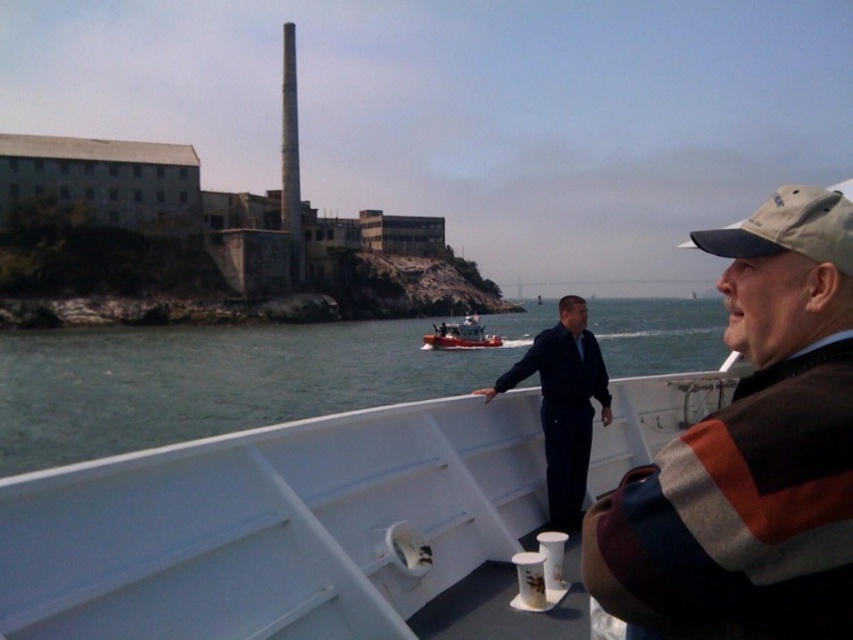
Question: Does brown striped sweater at right have a larger size compared to green water at center?

Choices:
 (A) no
 (B) yes

Answer: (A)

Question: Which object appears closest to the camera in this image?

Choices:
 (A) metallic red boat at center
 (B) green water at center
 (C) dark blue suit at center
 (D) brown striped sweater at right

Answer: (D)

Question: Does green water at center appear under metallic red boat at center?

Choices:
 (A) no
 (B) yes

Answer: (A)

Question: Estimate the real-world distances between objects in this image. Which object is farther from the dark blue suit at center?

Choices:
 (A) metallic red boat at center
 (B) green water at center

Answer: (B)

Question: Which point is farther to the camera?

Choices:
 (A) (28, 410)
 (B) (695, 573)

Answer: (A)

Question: In this image, where is green water at center located relative to dark blue suit at center?

Choices:
 (A) above
 (B) below

Answer: (A)